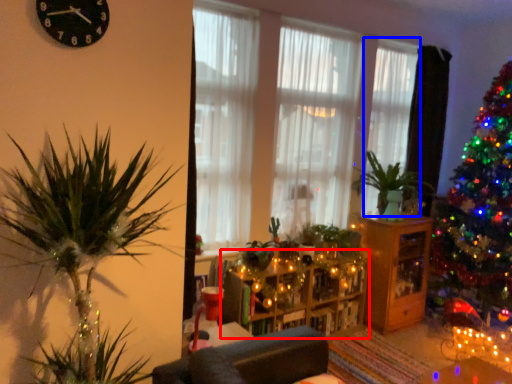
Question: Which of the following is the farthest to the observer, entertainment center (highlighted by a red box) or curtain (highlighted by a blue box)?

Choices:
 (A) entertainment center
 (B) curtain

Answer: (B)